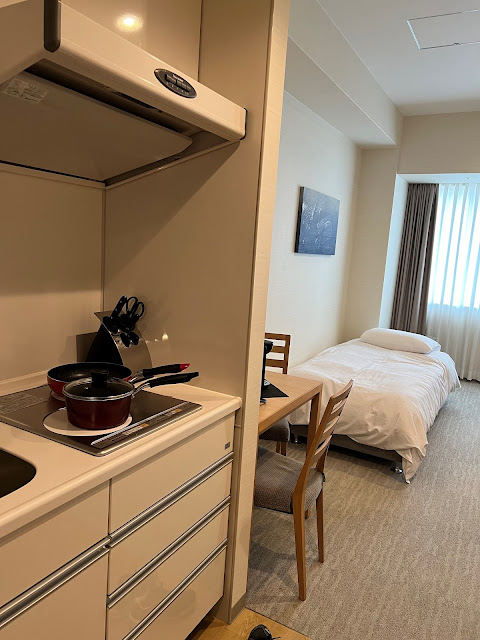
Identify the location of left curtain/drape. (418, 237).